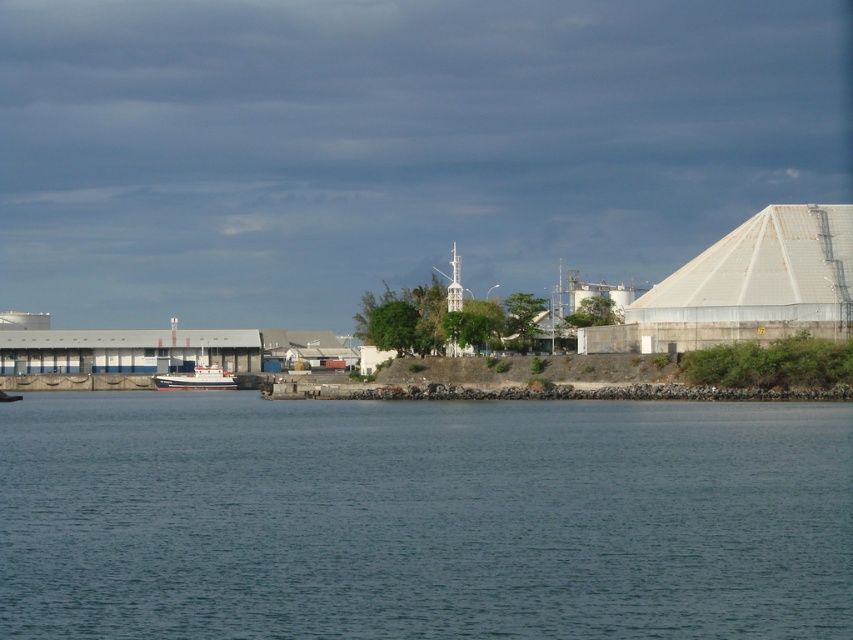
Question: From the image, what is the correct spatial relationship of blue water at lower center in relation to white matte boat at center?

Choices:
 (A) below
 (B) above

Answer: (B)

Question: Which point appears closest to the camera in this image?

Choices:
 (A) pyautogui.click(x=834, y=586)
 (B) pyautogui.click(x=171, y=378)

Answer: (A)

Question: Which object is farther from the camera taking this photo?

Choices:
 (A) white matte boat at center
 (B) blue water at lower center

Answer: (A)

Question: Is blue water at lower center below white matte boat at center?

Choices:
 (A) yes
 (B) no

Answer: (B)

Question: Does blue water at lower center have a greater width compared to white matte boat at center?

Choices:
 (A) yes
 (B) no

Answer: (A)